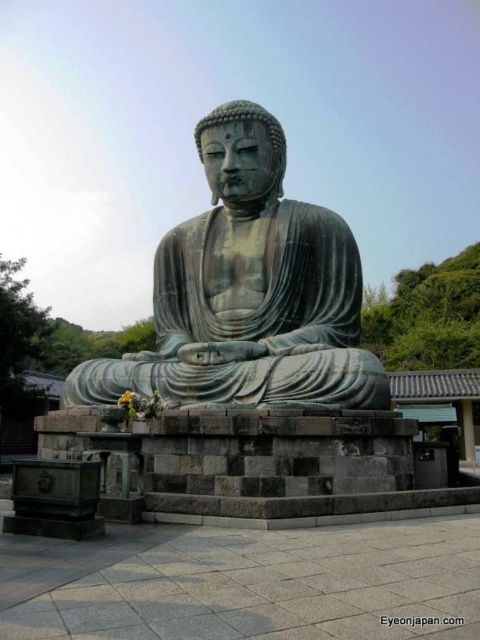
You are a visitor at the temple and want to place a flower offering at the base of both the green patina stone statue at center and the matte bronze statue at center. Given that you can only carry the flowers for a maximum distance of 25 feet, will you be able to place the offerings at both statues without needing to return to your starting point?

The green patina stone statue at center and the matte bronze statue at center are 24.03 feet apart from each other. Since the maximum distance you can carry the flowers is 25 feet, you can walk from one statue to the other and place both offerings without needing to return to your starting point.

You are standing in front of the temple and want to take a photo of the green patina stone statue at center. If you are at position 0, where would you need to position yourself to capture the statue in the frame?

The green patina stone statue at center is located at point 0.456 on the x and 0.519 on the y coordinates, so you should position yourself around those coordinates to capture it in the frame.

You are a visitor at the temple and want to take a photo of both the green patina stone statue at center and the matte bronze statue at center. Which statue should you stand to the left of to capture both in the frame?

You should stand to the left of the matte bronze statue at center because the green patina stone statue at center is positioned on the left side of it, so both will be in the frame when you position yourself there.